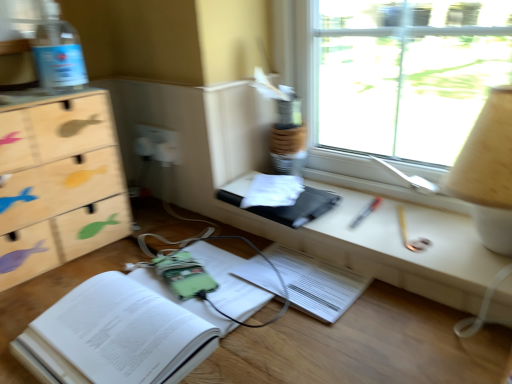
You are a GUI agent. You are given a task and a screenshot of the screen. Output one action in this format:
    pyautogui.click(x=<x>, y=<y>)
    Task: Click on the free spot to the right of wooden fish-patterned chest of drawers at left
    
    Given the screenshot: What is the action you would take?
    (x=145, y=236)